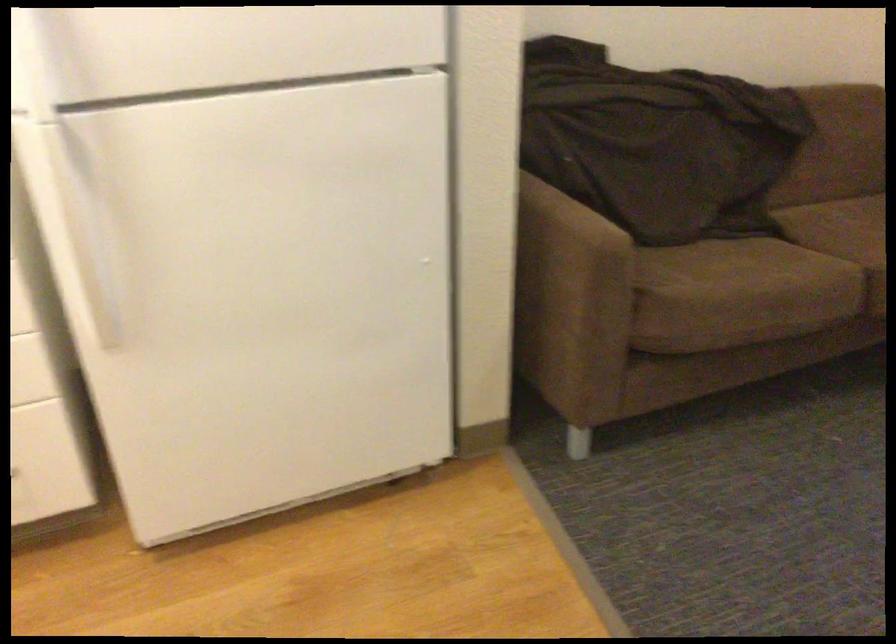
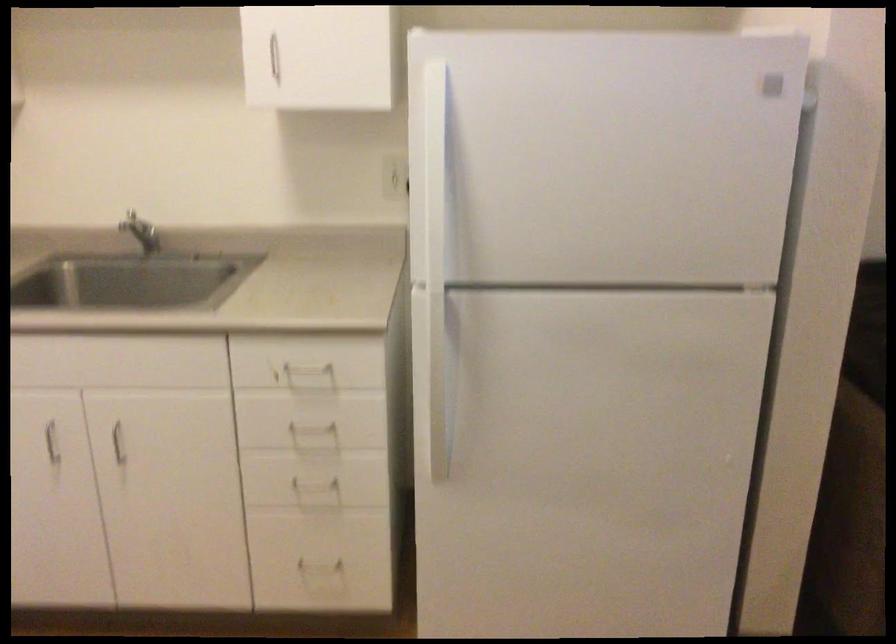
Question: Based on the continuous images, in which direction is the camera rotating? Reply with the corresponding letter.

Choices:
 (A) Left
 (B) Right
 (C) Up
 (D) Down

Answer: (A)